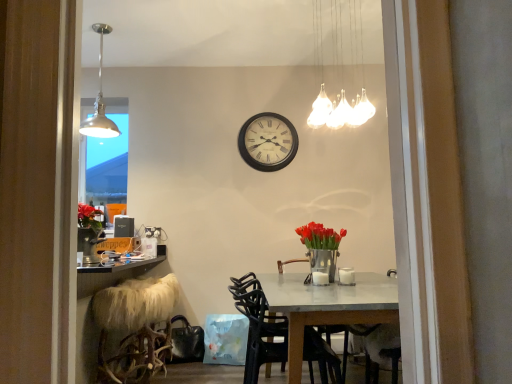
Question: Considering the positions of white glass chandelier at upper center, acting as the 1th lamp starting from the front, and metallic vase with red tulips at center in the image, is white glass chandelier at upper center, acting as the 1th lamp starting from the front, taller or shorter than metallic vase with red tulips at center?

Choices:
 (A) tall
 (B) short

Answer: (A)

Question: From a real-world perspective, relative to metallic vase with red tulips at center, is white glass chandelier at upper center, acting as the 1th lamp starting from the front, vertically above or below?

Choices:
 (A) above
 (B) below

Answer: (A)

Question: Estimate the real-world distances between objects in this image. Which object is closer to the metallic pendant light at upper left, the first lamp from the left?

Choices:
 (A) metallic vase with red tulips at center
 (B) fuzzy white stool at lower left
 (C) black plastic chair at center
 (D) wooden wall clock at center
 (E) white glass chandelier at upper center, acting as the 1th lamp starting from the front

Answer: (D)

Question: Estimate the real-world distances between objects in this image. Which object is closer to the white glass chandelier at upper center, the second lamp in the left-to-right sequence?

Choices:
 (A) wooden wall clock at center
 (B) black plastic chair at center
 (C) fuzzy white stool at lower left
 (D) metallic vase with red tulips at center
 (E) metallic pendant light at upper left, the first lamp when ordered from back to front

Answer: (A)